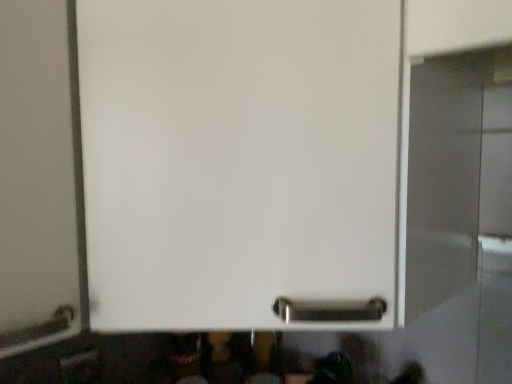
Describe the element at coordinates (237, 159) in the screenshot. I see `white matte cabinet at center` at that location.

You are a GUI agent. You are given a task and a screenshot of the screen. Output one action in this format:
    pyautogui.click(x=<x>, y=<y>)
    Task: Click on the white matte cabinet at center
    This screenshot has height=384, width=512.
    Given the screenshot: What is the action you would take?
    pyautogui.click(x=237, y=159)

Find the location of a particular element. white matte cabinet at center is located at coordinates (237, 159).